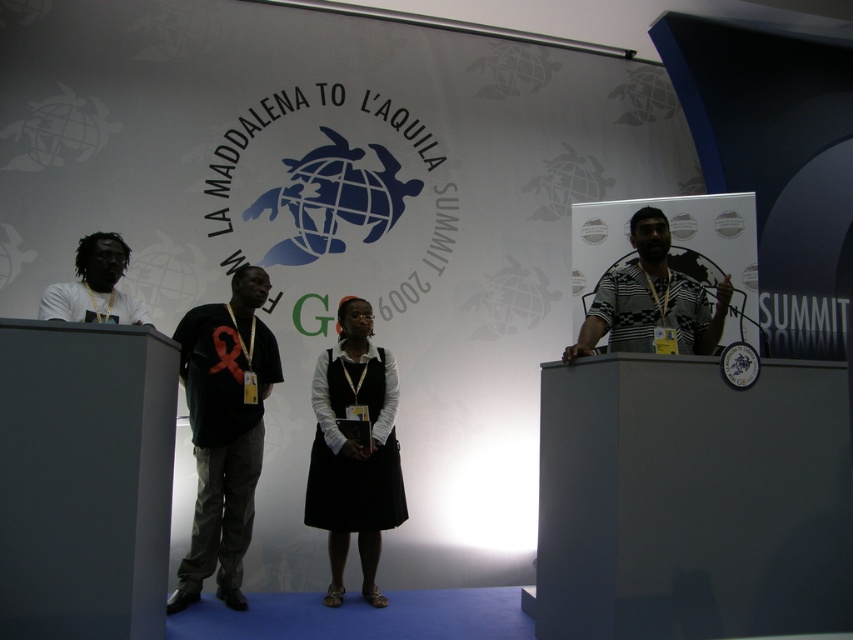
Question: Which point appears farthest from the camera in this image?

Choices:
 (A) (184, 608)
 (B) (595, 291)
 (C) (123, 259)

Answer: (B)

Question: Which point appears farthest from the camera in this image?

Choices:
 (A) (670, 301)
 (B) (250, 484)
 (C) (56, 292)
 (D) (314, 470)

Answer: (D)

Question: Is striped fabric shirt at right above matte white shirt at left?

Choices:
 (A) yes
 (B) no

Answer: (B)

Question: Which object is closer to the camera taking this photo?

Choices:
 (A) black matte t-shirt at center
 (B) matte white shirt at left
 (C) striped fabric shirt at right

Answer: (C)

Question: Is black matte t-shirt at center closer to the viewer compared to black matte dress at center?

Choices:
 (A) yes
 (B) no

Answer: (A)

Question: Does striped fabric shirt at right come behind matte white shirt at left?

Choices:
 (A) no
 (B) yes

Answer: (A)